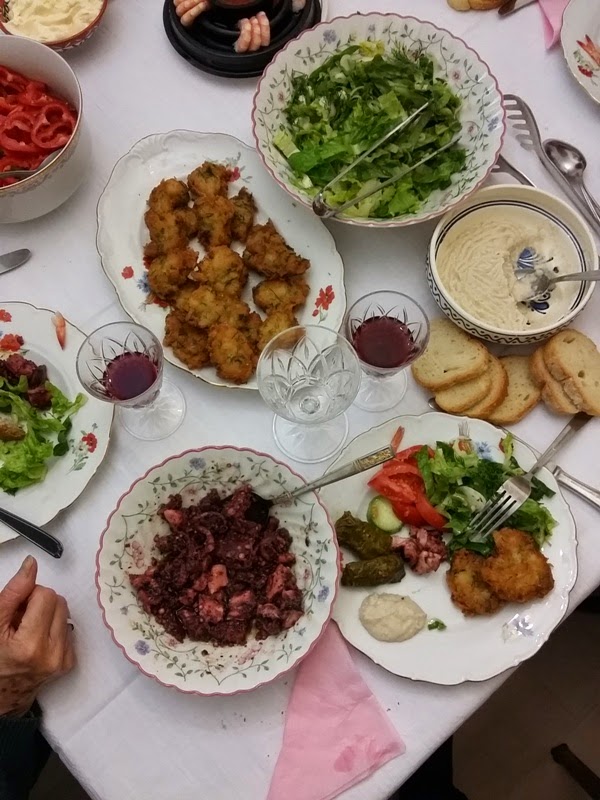
The width and height of the screenshot is (600, 800). Find the location of `bowl`. bowl is located at coordinates (90, 26), (502, 342), (57, 182).